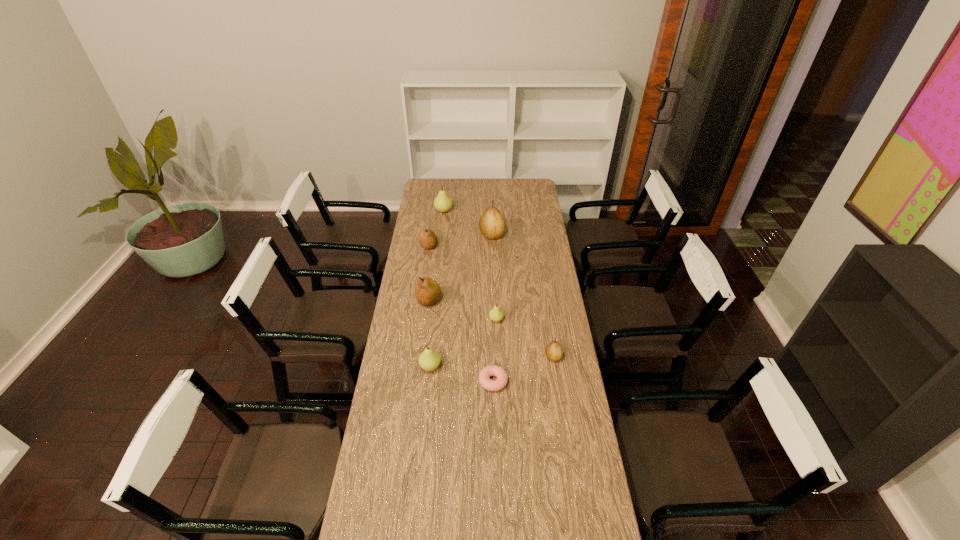
I want to click on vacant space positioned 0.140m on the back of the nearest brown pear, so click(x=548, y=325).

Locate an element on the screen. This screenshot has height=540, width=960. free space located on the front of the shortest object is located at coordinates (494, 435).

The width and height of the screenshot is (960, 540). I want to click on object that is at the right edge, so click(554, 352).

Where is `vacant space at the left edge of the desktop`? vacant space at the left edge of the desktop is located at coordinates (386, 433).

Locate an element on the screen. This screenshot has height=540, width=960. free space at the right edge of the desktop is located at coordinates (577, 392).

At what (x,y) coordinates should I click in order to perform the action: click on free space between the tallest pear and the second nearest green pear. Please return your answer as a coordinate pair (x, y). This screenshot has height=540, width=960. Looking at the image, I should click on (494, 277).

Where is `free space between the shortest object and the third biggest brown pear`? free space between the shortest object and the third biggest brown pear is located at coordinates (461, 314).

You are a GUI agent. You are given a task and a screenshot of the screen. Output one action in this format:
    pyautogui.click(x=<x>, y=<y>)
    Task: Click on the vacant region between the rightmost object and the third nearest pear
    
    Given the screenshot: What is the action you would take?
    pyautogui.click(x=525, y=339)

Identify the location of free space that is in between the biggest brown pear and the shortest object. The height and width of the screenshot is (540, 960). (492, 308).

The image size is (960, 540). I want to click on free spot between the rightmost brown pear and the fourth nearest object, so click(x=525, y=339).